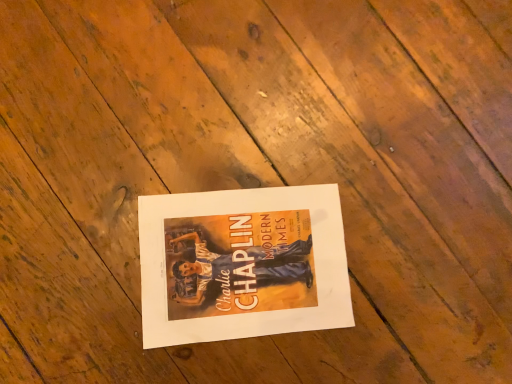
Identify the location of matte paper poster at center. This screenshot has height=384, width=512. (242, 264).

What do you see at coordinates (242, 264) in the screenshot? I see `matte paper poster at center` at bounding box center [242, 264].

In order to face matte paper poster at center, should I rotate leftwards or rightwards?

Turn left approximately 1.030 degrees to face it.

You are a GUI agent. You are given a task and a screenshot of the screen. Output one action in this format:
    pyautogui.click(x=<x>, y=<y>)
    Task: Click on the matte paper poster at center
    The width and height of the screenshot is (512, 384).
    Given the screenshot: What is the action you would take?
    [242, 264]